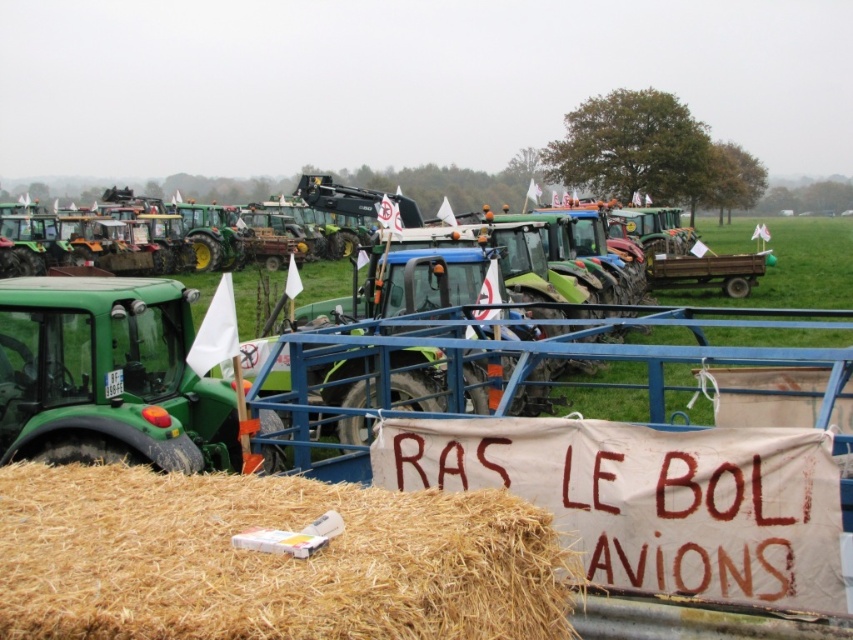
Looking at this image, you are standing at the edge of the tractor gathering and want to place a new hay bale to the right of the existing straw bale at lower center. Will this new hay bale be positioned to the left or right of the white fabric banner at center?

Result: The straw bale at lower center is to the left of the white fabric banner at center. Placing a new hay bale to the right of the existing straw bale at lower center would position it to the left of the white fabric banner at center as well.

You are a photographer trying to capture both the straw bale at lower center and the white fabric banner at center in a single shot. Based on their positions, which object should you focus on first to ensure both are in frame?

The straw bale at lower center is below the white fabric banner at center, so you should focus on the white fabric banner at center first to ensure both are in frame.